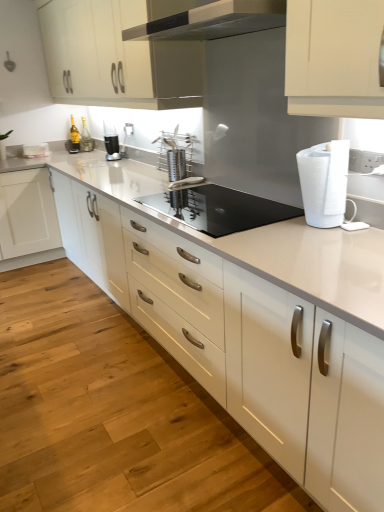
What is the approximate width of black plastic blender at center?

The width of black plastic blender at center is 12.47 centimeters.

In order to face black plastic blender at center, should I rotate leftwards or rightwards?

Answer: To face it directly, rotate left by 10.769 degrees.

Where is `white plastic paper towel at right`? The height and width of the screenshot is (512, 384). white plastic paper towel at right is located at coordinates pos(324,182).

The height and width of the screenshot is (512, 384). What do you see at coordinates (118, 55) in the screenshot?
I see `matte white cabinets at upper center` at bounding box center [118, 55].

Find the location of a particular element. This screenshot has width=384, height=512. black glass cooktop at center, the second appliance from the back is located at coordinates (218, 208).

Between matte white cabinets at upper center and black glass cooktop at center, the first appliance when ordered from bottom to top, which one appears on the right side from the viewer's perspective?

Positioned to the right is black glass cooktop at center, the first appliance when ordered from bottom to top.

Is matte white cabinets at upper center located outside black glass cooktop at center, the second appliance from the back?

Yes, matte white cabinets at upper center is located beyond the bounds of black glass cooktop at center, the second appliance from the back.

How different are the orientations of matte white cabinets at upper center and black glass cooktop at center, which is the 2th appliance in top-to-bottom order, in degrees?

The angle between the facing direction of matte white cabinets at upper center and the facing direction of black glass cooktop at center, which is the 2th appliance in top-to-bottom order, is 0.109 degrees.

Is matte white cabinets at upper center thinner than black glass cooktop at center, which is the 2th appliance in top-to-bottom order?

Correct, the width of matte white cabinets at upper center is less than that of black glass cooktop at center, which is the 2th appliance in top-to-bottom order.

Is point (294, 310) closer to camera compared to point (105, 145)?

Yes, point (294, 310) is closer to viewer.

From a real-world perspective, is white glossy countertop at center located beneath black plastic blender at center?

Yes, from a real-world perspective, white glossy countertop at center is beneath black plastic blender at center.

Is white glossy countertop at center not within black plastic blender at center?

Indeed, white glossy countertop at center is completely outside black plastic blender at center.

Consider the image. Is white glossy countertop at center not close to black plastic blender at center?

white glossy countertop at center is positioned a significant distance from black plastic blender at center.

From a real-world perspective, does matte white cabinets at upper center sit lower than white plastic paper towel at right?

Actually, matte white cabinets at upper center is physically above white plastic paper towel at right in the real world.

Are matte white cabinets at upper center and white plastic paper towel at right far apart?

Yes, matte white cabinets at upper center and white plastic paper towel at right are located far from each other.

Does matte white cabinets at upper center appear on the right side of white plastic paper towel at right?

In fact, matte white cabinets at upper center is to the left of white plastic paper towel at right.

Who is taller, matte white cabinets at upper center or white plastic paper towel at right?

matte white cabinets at upper center is taller.

Based on the photo, can you confirm if black glass cooktop at center, which is the 2th appliance in top-to-bottom order, is bigger than matte white cabinets at upper center?

Actually, black glass cooktop at center, which is the 2th appliance in top-to-bottom order, might be smaller than matte white cabinets at upper center.

From a real-world perspective, is black glass cooktop at center, the first appliance when ordered from bottom to top, under matte white cabinets at upper center?

Yes, from a real-world perspective, black glass cooktop at center, the first appliance when ordered from bottom to top, is beneath matte white cabinets at upper center.

Which object is closer to the camera, white plastic paper towel at right or satin silver utensil holder at center, the second appliance from the bottom?

white plastic paper towel at right is in front.

Who is smaller, white plastic paper towel at right or satin silver utensil holder at center, the first appliance in the top-to-bottom sequence?

With smaller size is white plastic paper towel at right.

What are the coordinates of `appliance located above the white plastic paper towel at right (from a real-world perspective)` in the screenshot? It's located at (176, 153).

In the scene shown: Between white plastic paper towel at right and satin silver utensil holder at center, the first appliance in the top-to-bottom sequence, which one has less height?

satin silver utensil holder at center, the first appliance in the top-to-bottom sequence.

Can you confirm if satin silver utensil holder at center, the second appliance from the bottom, is thinner than black glass cooktop at center, which is the 2th appliance in top-to-bottom order?

Yes.

Which is behind, satin silver utensil holder at center, the first appliance in the top-to-bottom sequence, or black glass cooktop at center, the first appliance when ordered from bottom to top?

satin silver utensil holder at center, the first appliance in the top-to-bottom sequence, is more distant.

Considering the relative sizes of satin silver utensil holder at center, the second appliance from the front, and black glass cooktop at center, the first appliance when ordered from bottom to top, in the image provided, is satin silver utensil holder at center, the second appliance from the front, taller than black glass cooktop at center, the first appliance when ordered from bottom to top,?

Yes, satin silver utensil holder at center, the second appliance from the front, is taller than black glass cooktop at center, the first appliance when ordered from bottom to top.

Where is `appliance above the black glass cooktop at center, the first appliance when ordered from bottom to top (from the image's perspective)`? The image size is (384, 512). appliance above the black glass cooktop at center, the first appliance when ordered from bottom to top (from the image's perspective) is located at coordinates point(176,153).

The width and height of the screenshot is (384, 512). I want to click on paper towel that is in front of the black glass cooktop at center, the first appliance when ordered from bottom to top, so click(x=324, y=182).

In terms of width, does black glass cooktop at center, the 1th appliance from the front, look wider or thinner when compared to white plastic paper towel at right?

black glass cooktop at center, the 1th appliance from the front, is wider than white plastic paper towel at right.

Does black glass cooktop at center, the second appliance from the back, appear on the right side of white plastic paper towel at right?

Incorrect, black glass cooktop at center, the second appliance from the back, is not on the right side of white plastic paper towel at right.

Identify the location of cabinetry behind the black glass cooktop at center, the second appliance from the back. (118, 55).

The width and height of the screenshot is (384, 512). Find the location of `countertop located in front of the black plastic blender at center`. countertop located in front of the black plastic blender at center is located at coordinates (246, 319).

From the image, which object appears to be nearer to black plastic blender at center, white glossy countertop at center or matte white cabinets at upper center?

matte white cabinets at upper center is positioned closer to the anchor black plastic blender at center.

From the image, which object appears to be farther from black plastic blender at center, white plastic paper towel at right or satin silver utensil holder at center, marked as the first appliance in a back-to-front arrangement?

Based on the image, white plastic paper towel at right appears to be further to black plastic blender at center.

From the image, which object appears to be nearer to black glass cooktop at center, the first appliance when ordered from bottom to top, white plastic paper towel at right or satin silver utensil holder at center, the second appliance from the bottom?

The object closer to black glass cooktop at center, the first appliance when ordered from bottom to top, is white plastic paper towel at right.

Estimate the real-world distances between objects in this image. Which object is further from white glossy countertop at center, black plastic blender at center or black glass cooktop at center, the first appliance when ordered from bottom to top?

The object further to white glossy countertop at center is black plastic blender at center.

From the image, which object appears to be farther from matte white cabinets at upper center, satin silver utensil holder at center, the second appliance from the front, or white glossy countertop at center?

white glossy countertop at center.

Looking at the image, which one is located further to white plastic paper towel at right, black glass cooktop at center, the second appliance from the back, or matte white cabinets at upper center?

Among the two, matte white cabinets at upper center is located further to white plastic paper towel at right.

From the image, which object appears to be nearer to satin silver utensil holder at center, marked as the first appliance in a back-to-front arrangement, black plastic blender at center or white glossy countertop at center?

Based on the image, black plastic blender at center appears to be nearer to satin silver utensil holder at center, marked as the first appliance in a back-to-front arrangement.

When comparing their distances from white glossy countertop at center, does satin silver utensil holder at center, the second appliance from the front, or black glass cooktop at center, which is the 2th appliance in top-to-bottom order, seem closer?

Among the two, black glass cooktop at center, which is the 2th appliance in top-to-bottom order, is located nearer to white glossy countertop at center.

Locate an element on the screen. appliance between black glass cooktop at center, the first appliance when ordered from bottom to top, and black plastic blender at center, along the z-axis is located at coordinates (176, 153).

The image size is (384, 512). I want to click on cabinetry between white glossy countertop at center and satin silver utensil holder at center, marked as the first appliance in a back-to-front arrangement, from front to back, so click(118, 55).

What are the coordinates of `appliance between matte white cabinets at upper center and black glass cooktop at center, the first appliance when ordered from bottom to top, from top to bottom` in the screenshot? It's located at (176, 153).

Identify the location of paper towel positioned between white glossy countertop at center and matte white cabinets at upper center from near to far. This screenshot has height=512, width=384. (324, 182).